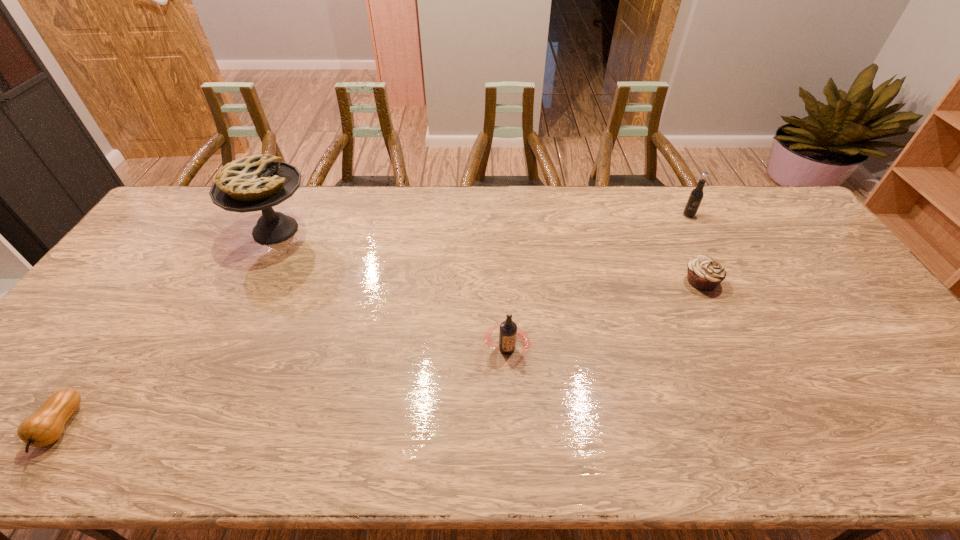
The width and height of the screenshot is (960, 540). In order to click on pie in this screenshot , I will do [253, 183].

Identify the location of the tallest object. This screenshot has width=960, height=540. (253, 183).

Where is `the farther root beer`? the farther root beer is located at coordinates (696, 195).

Where is `the right root beer`? This screenshot has height=540, width=960. the right root beer is located at coordinates (696, 195).

Where is `the third shortest object`? This screenshot has height=540, width=960. the third shortest object is located at coordinates click(508, 331).

Locate an element on the screen. the second nearest object is located at coordinates (508, 331).

You are a GUI agent. You are given a task and a screenshot of the screen. Output one action in this format:
    pyautogui.click(x=<x>, y=<y>)
    Task: Click on the third farthest object
    
    Given the screenshot: What is the action you would take?
    pyautogui.click(x=705, y=273)

Find the location of `the leftmost object`. the leftmost object is located at coordinates (43, 428).

You are a GUI agent. You are given a task and a screenshot of the screen. Output one action in this format:
    pyautogui.click(x=<x>, y=<y>)
    Task: Click on the gourd
    This screenshot has height=540, width=960.
    Given the screenshot: What is the action you would take?
    pyautogui.click(x=43, y=428)

Identify the location of blank space located 0.050m on the cut side of the pie. This screenshot has width=960, height=540. (330, 230).